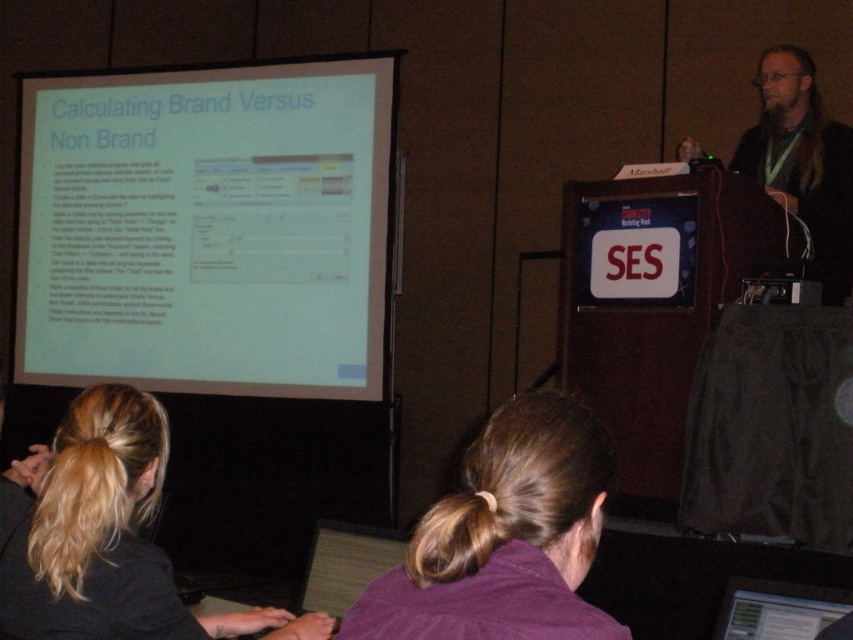
Does point (129, 164) lie in front of point (664, 218)?

No.

Can you confirm if white paper at upper left is smaller than red plastic ses sign at center?

Incorrect, white paper at upper left is not smaller in size than red plastic ses sign at center.

Between point (198, 72) and point (666, 248), which one is positioned in front?

Positioned in front is point (666, 248).

You are a GUI agent. You are given a task and a screenshot of the screen. Output one action in this format:
    pyautogui.click(x=<x>, y=<y>)
    Task: Click on the white paper at upper left
    Image resolution: width=853 pixels, height=640 pixels.
    Given the screenshot: What is the action you would take?
    pyautogui.click(x=206, y=228)

Does brown hair at center have a greater width compared to red plastic ses sign at center?

No, brown hair at center is not wider than red plastic ses sign at center.

Consider the image. Which of these two, brown hair at center or red plastic ses sign at center, stands shorter?

With less height is brown hair at center.

Is point (511, 488) positioned after point (630, 276)?

That is False.

Where is `brown hair at center`? brown hair at center is located at coordinates (503, 538).

Which is behind, point (26, 582) or point (831, 593)?

The point (831, 593) is more distant.

Where is `blonde hair at upper left`? This screenshot has width=853, height=640. blonde hair at upper left is located at coordinates (106, 536).

Locate an element on the screen. The height and width of the screenshot is (640, 853). blonde hair at upper left is located at coordinates (106, 536).

The height and width of the screenshot is (640, 853). I want to click on blonde hair at upper left, so click(x=106, y=536).